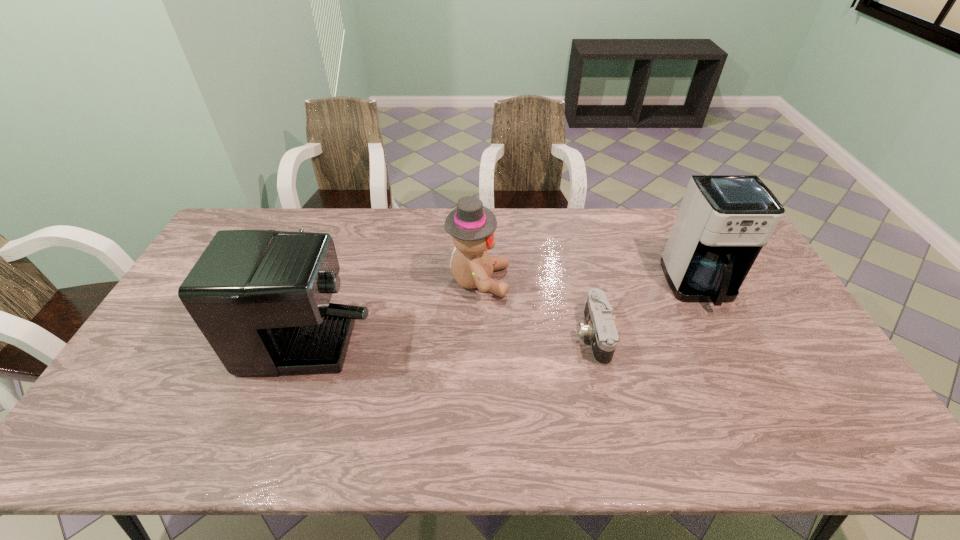
This screenshot has height=540, width=960. In order to click on free space located on the lens of the shortest object in this screenshot , I will do `click(465, 335)`.

This screenshot has width=960, height=540. Find the location of `object at the far edge`. object at the far edge is located at coordinates (261, 298).

Where is `object positioned at the left edge`? The image size is (960, 540). object positioned at the left edge is located at coordinates (261, 298).

The height and width of the screenshot is (540, 960). What are the coordinates of `object that is at the right edge` in the screenshot? It's located at point(723,222).

In order to click on object that is at the far left corner in this screenshot , I will do `click(261, 298)`.

Identify the location of free space at the far edge of the desktop. (544, 233).

Image resolution: width=960 pixels, height=540 pixels. In the image, there is a desktop. In order to click on vacant space at the near edge in this screenshot , I will do `click(669, 458)`.

In the image, there is a desktop. Identify the location of vacant space at the left edge. (204, 345).

In the image, there is a desktop. Where is `free space at the right edge`? The height and width of the screenshot is (540, 960). free space at the right edge is located at coordinates (788, 318).

This screenshot has width=960, height=540. I want to click on free space that is in between the second object from right to left and the right coffee maker, so click(x=646, y=311).